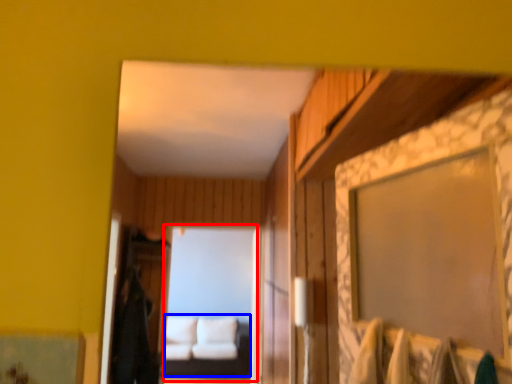
Question: Which point is further to the camera, mirror (highlighted by a red box) or couch (highlighted by a blue box)?

Choices:
 (A) mirror
 (B) couch

Answer: (B)